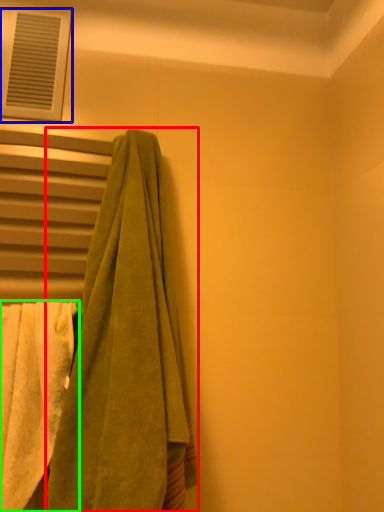
Question: Considering the real-world distances, which object is closest to towel (highlighted by a red box)? window (highlighted by a blue box) or towel (highlighted by a green box).

Choices:
 (A) window
 (B) towel

Answer: (B)